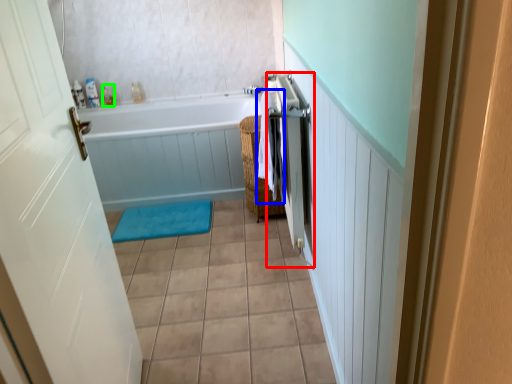
Question: Estimate the real-world distances between objects in this image. Which object is farther from shower door (highlighted by a red box), beach towel (highlighted by a blue box) or toiletry (highlighted by a green box)?

Choices:
 (A) beach towel
 (B) toiletry

Answer: (B)